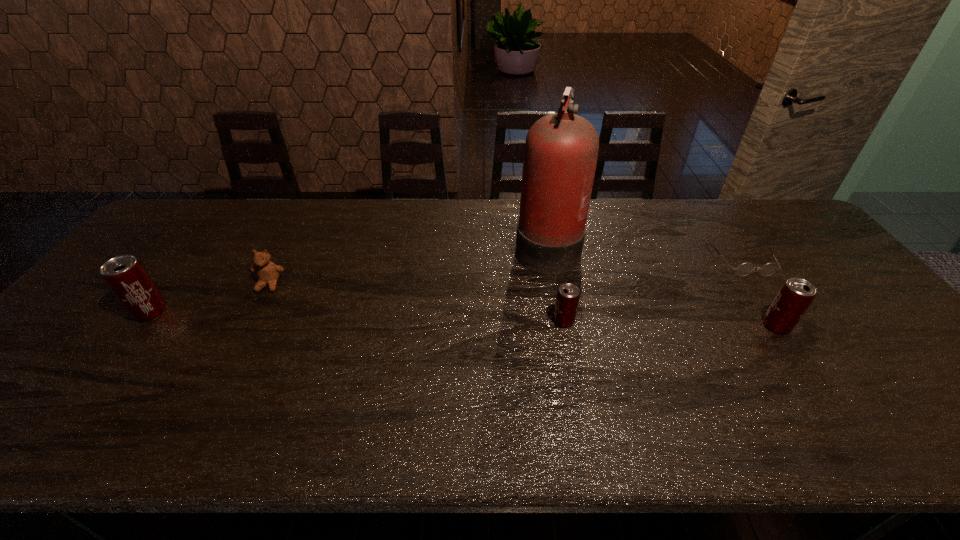
Where is `vacant space located 0.080m on the back of the third tallest object`? vacant space located 0.080m on the back of the third tallest object is located at coordinates (756, 294).

Locate an element on the screen. vacant space located at the nozzle of the fire extinguisher is located at coordinates (419, 245).

At what (x,y) coordinates should I click in order to perform the action: click on free space located at the nozzle of the fire extinguisher. Please return your answer as a coordinate pair (x, y). This screenshot has width=960, height=540. Looking at the image, I should click on pos(419,245).

Identify the location of vacant space located 0.260m at the nozzle of the fire extinguisher. Image resolution: width=960 pixels, height=540 pixels. (431, 245).

At what (x,y) coordinates should I click in order to perform the action: click on free space located 0.240m through the lenses of the spectacles. Please return your answer as a coordinate pair (x, y). The width and height of the screenshot is (960, 540). Looking at the image, I should click on (799, 342).

Identify the location of vacant space situated on the face of the second object from left to right. The image size is (960, 540). (227, 368).

Find the location of `object situated at the far edge`. object situated at the far edge is located at coordinates (561, 149).

Identify the location of object that is at the left edge. The image size is (960, 540). (126, 277).

At what (x,y) coordinates should I click in order to perform the action: click on blank area at the far edge. Please return your answer as a coordinate pair (x, y). Image resolution: width=960 pixels, height=540 pixels. Looking at the image, I should click on (681, 230).

You are a GUI agent. You are given a task and a screenshot of the screen. Output one action in this format:
    pyautogui.click(x=<x>, y=<y>)
    Task: Click on the vacant space at the left edge
    
    Given the screenshot: What is the action you would take?
    pyautogui.click(x=110, y=338)